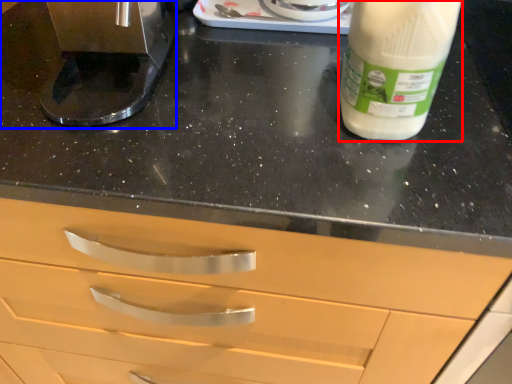
Question: Among these objects, which one is farthest to the camera, yoghurt (highlighted by a red box) or coffee machine (highlighted by a blue box)?

Choices:
 (A) yoghurt
 (B) coffee machine

Answer: (B)